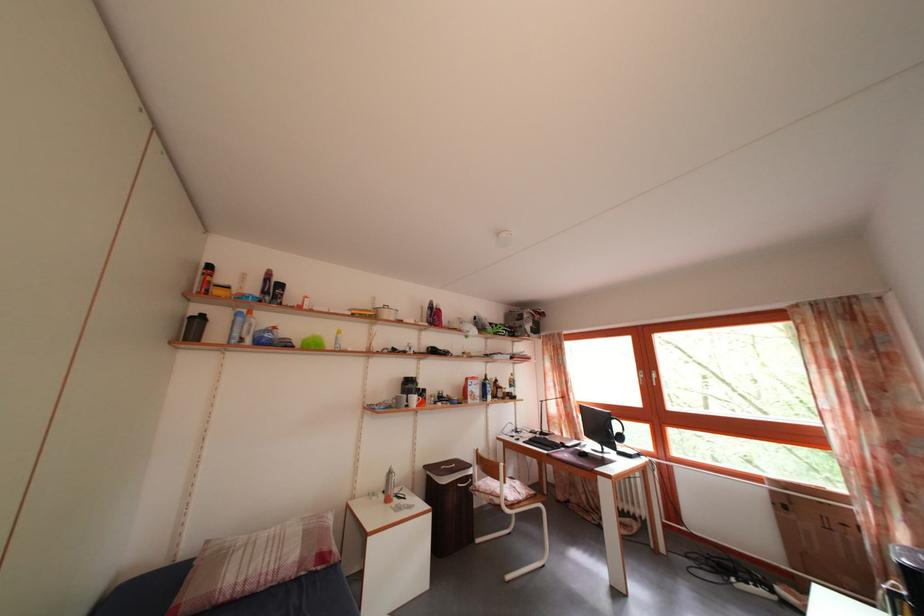
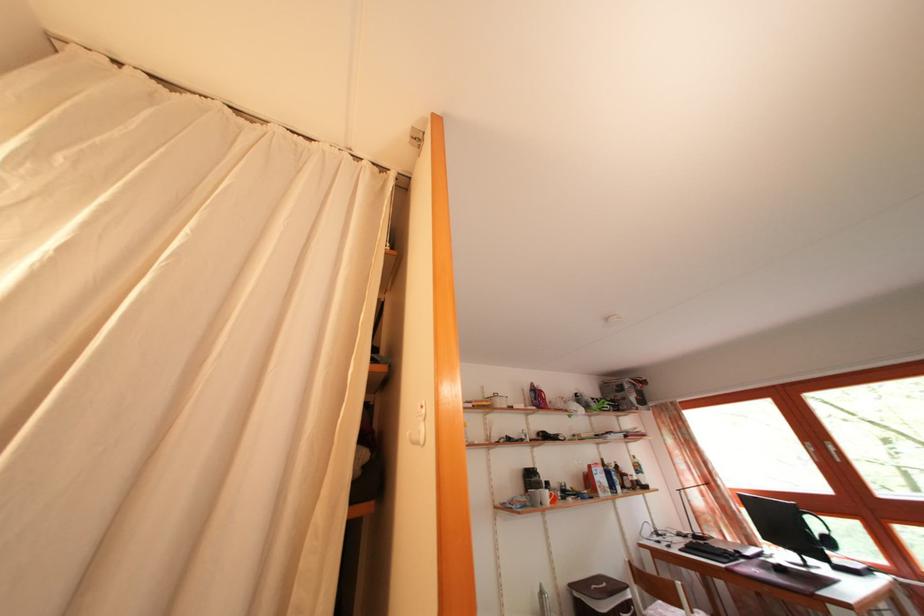
The point at (417,392) is marked in the first image. Where is the corresponding point in the second image?

(538, 484)